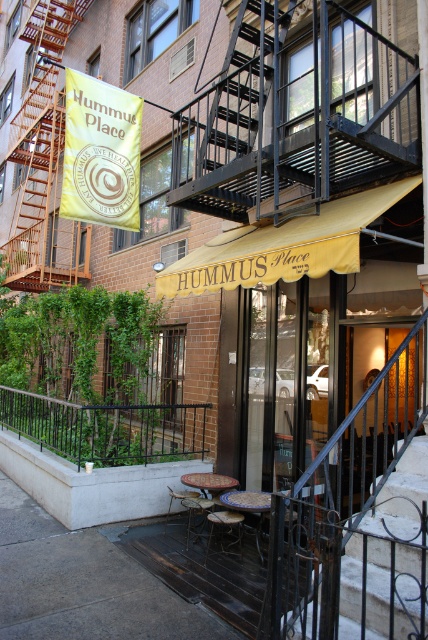
Can you confirm if gray concrete pavement at lower center is smaller than wooden fire escape at left?

No.

Measure the distance between point (97, 608) and camera.

Point (97, 608) is 14.32 feet away from camera.

What do you see at coordinates (83, 584) in the screenshot? I see `gray concrete pavement at lower center` at bounding box center [83, 584].

The image size is (428, 640). Identify the location of gray concrete pavement at lower center. (83, 584).

Describe the element at coordinates (369, 564) in the screenshot. This screenshot has width=428, height=640. I see `black wrought iron stairs at center` at that location.

Between black wrought iron stairs at center and black metal railing at lower center, which one has less height?

With less height is black metal railing at lower center.

The width and height of the screenshot is (428, 640). Identify the location of black wrought iron stairs at center. (369, 564).

Is point (0, 634) closer to viewer compared to point (85, 422)?

Yes, point (0, 634) is in front of point (85, 422).

Is gray concrete pavement at lower center behind black metal railing at lower center?

No, it is not.

Is point (11, 595) in front of point (154, 419)?

That is True.

This screenshot has width=428, height=640. What are the coordinates of `gray concrete pavement at lower center` in the screenshot? It's located at (83, 584).